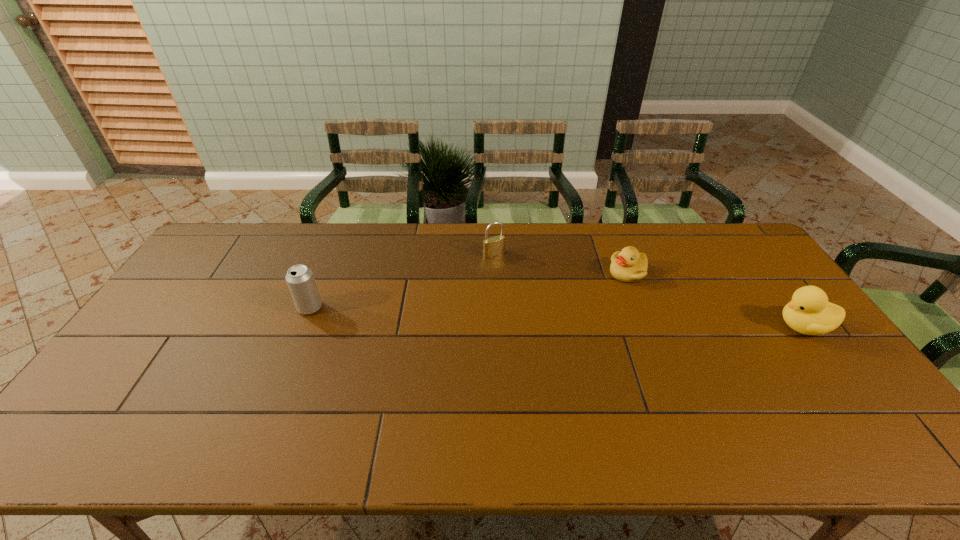
What are the coordinates of `vacant spot on the desktop that is between the leftmost object and the rightmost object and is positioned on the front-facing side of the padlock` in the screenshot? It's located at (546, 316).

Locate an element on the screen. The image size is (960, 540). free spot on the desktop that is between the leftmost object and the rightmost object and is positioned on the front-facing side of the second object from right to left is located at coordinates (589, 318).